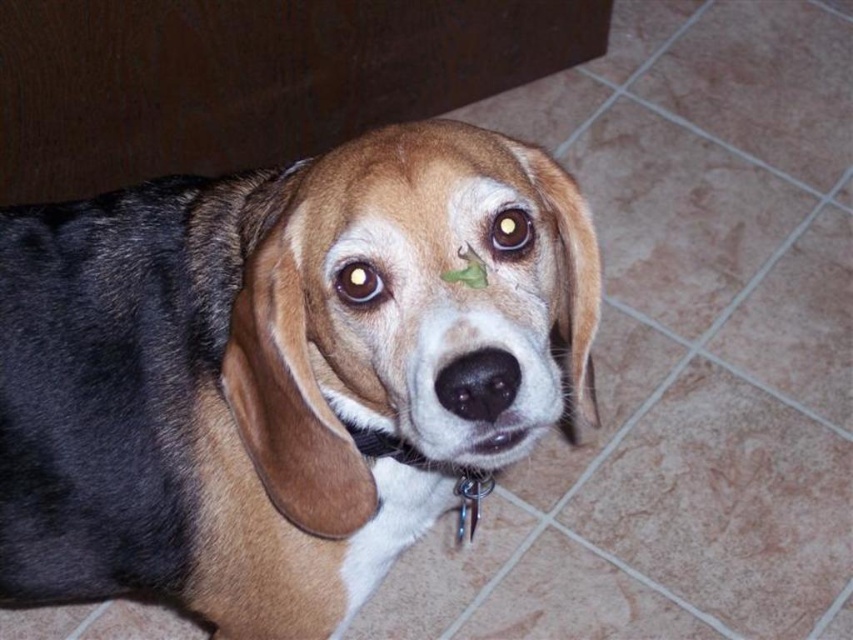
Question: Is brown fur eyebrow at upper center wider than brown shiny eye at center?

Choices:
 (A) no
 (B) yes

Answer: (B)

Question: Among these points, which one is farthest from the camera?

Choices:
 (A) (61, 358)
 (B) (360, 433)
 (C) (357, 273)

Answer: (A)

Question: Estimate the real-world distances between objects in this image. Which object is closer to the brown fur dog at center?

Choices:
 (A) brown fur eyebrow at upper center
 (B) brown shiny eye at center
 (C) brown glossy eye at center

Answer: (A)

Question: Where is brown fur dog at center located in relation to black smooth nose at center in the image?

Choices:
 (A) above
 (B) below

Answer: (B)

Question: Which of the following is the closest to the observer?

Choices:
 (A) (346, 422)
 (B) (341, 243)

Answer: (B)

Question: Does metallic chain at center have a greater width compared to brown fur eyebrow at upper center?

Choices:
 (A) yes
 (B) no

Answer: (A)